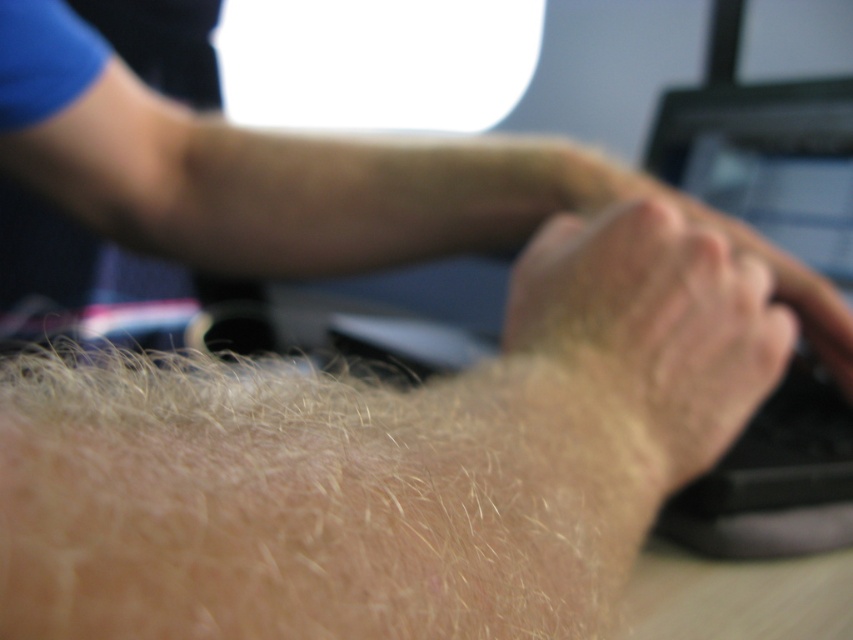
Question: Which object appears farthest from the camera in this image?

Choices:
 (A) black plastic keyboard at right
 (B) dry skin at center
 (C) light brown coarse hair at lower left
 (D) matte black monitor at center

Answer: (D)

Question: Is dry skin at center below black plastic keyboard at right?

Choices:
 (A) no
 (B) yes

Answer: (B)

Question: Which of the following is the farthest from the observer?

Choices:
 (A) black plastic keyboard at right
 (B) matte black monitor at center

Answer: (B)

Question: Is the position of light brown coarse hair at lower left more distant than that of dry skin at center?

Choices:
 (A) yes
 (B) no

Answer: (B)

Question: Which object is farther from the camera taking this photo?

Choices:
 (A) black plastic keyboard at right
 (B) matte black monitor at center

Answer: (B)

Question: Is dry skin at center further to camera compared to black plastic keyboard at right?

Choices:
 (A) no
 (B) yes

Answer: (A)